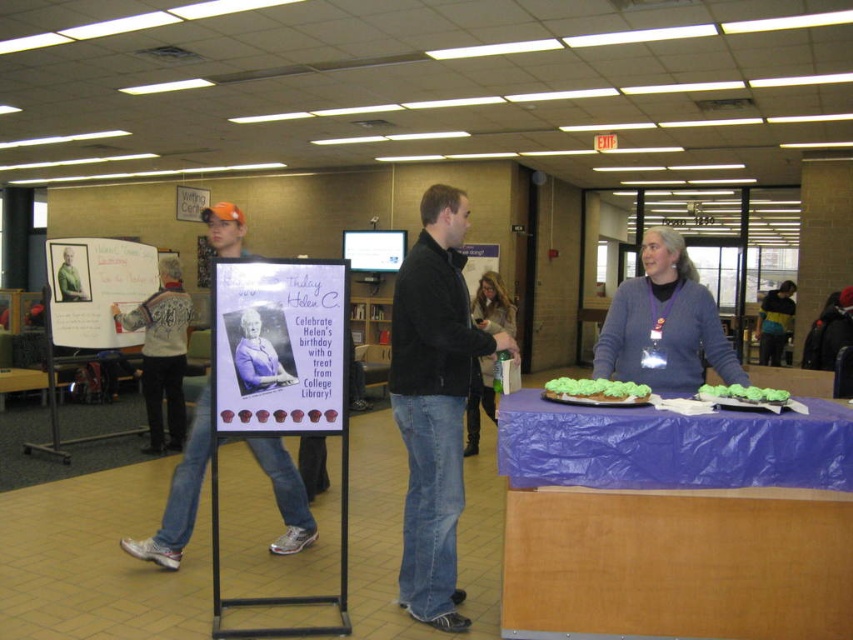
Can you confirm if blue fabric table at lower center is taller than black leather jacket at center?

No.

Consider the image. Between blue fabric table at lower center and black leather jacket at center, which one appears on the right side from the viewer's perspective?

Positioned to the right is blue fabric table at lower center.

The width and height of the screenshot is (853, 640). Identify the location of blue fabric table at lower center. (676, 522).

Find the location of a particular element. The width and height of the screenshot is (853, 640). blue fabric table at lower center is located at coordinates (676, 522).

Between green plastic cup at center and yellow fabric bag at center, which one is positioned higher?

yellow fabric bag at center is higher up.

Does green plastic cup at center have a lesser height compared to yellow fabric bag at center?

Indeed, green plastic cup at center has a lesser height compared to yellow fabric bag at center.

What are the coordinates of `green plastic cup at center` in the screenshot? It's located at (492, 305).

Find the location of a particular element. green plastic cup at center is located at coordinates (492, 305).

Does purple paper poster at center appear over white paperboard at upper left?

Incorrect, purple paper poster at center is not positioned above white paperboard at upper left.

In order to click on purple paper poster at center in this screenshot , I will do `click(277, 346)`.

Is point (316, 340) closer to viewer compared to point (113, 272)?

Yes, it is in front of point (113, 272).

I want to click on purple paper poster at center, so click(277, 346).